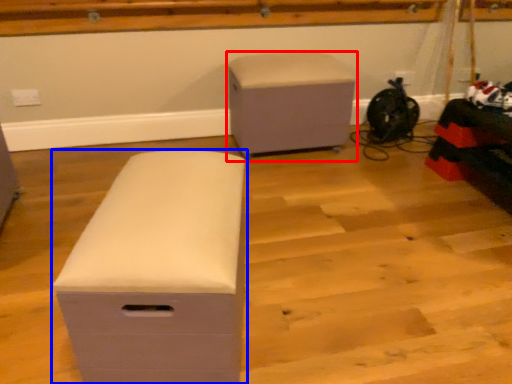
Question: Among these objects, which one is farthest to the camera, furniture (highlighted by a red box) or furniture (highlighted by a blue box)?

Choices:
 (A) furniture
 (B) furniture

Answer: (A)